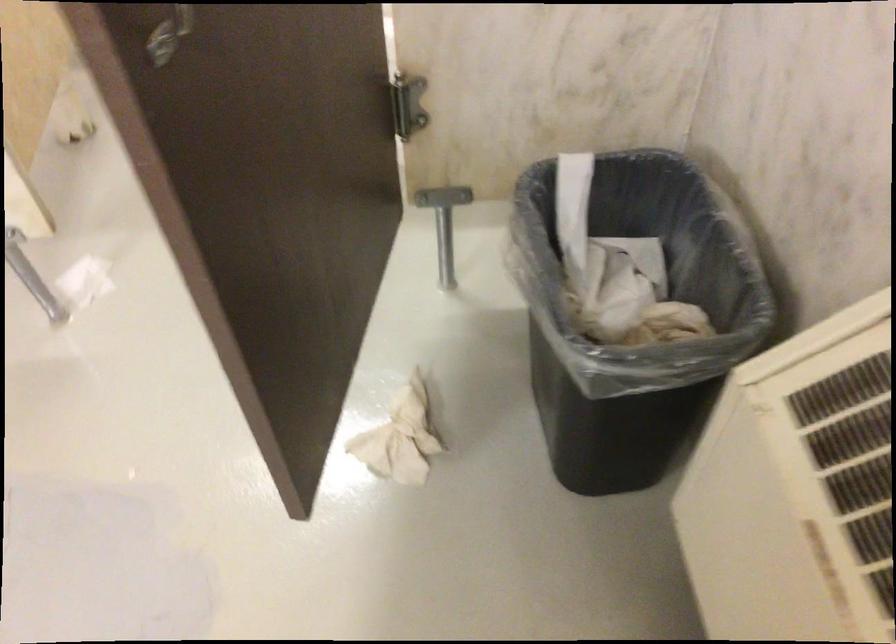
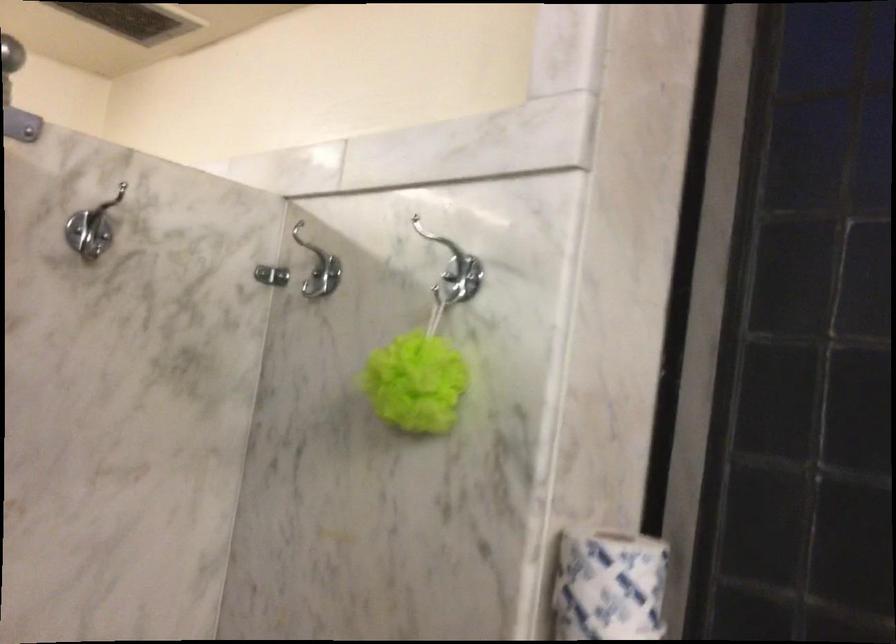
The images are taken continuously from a first-person perspective. In which direction is your viewpoint rotating?

The camera rotated toward right-up.